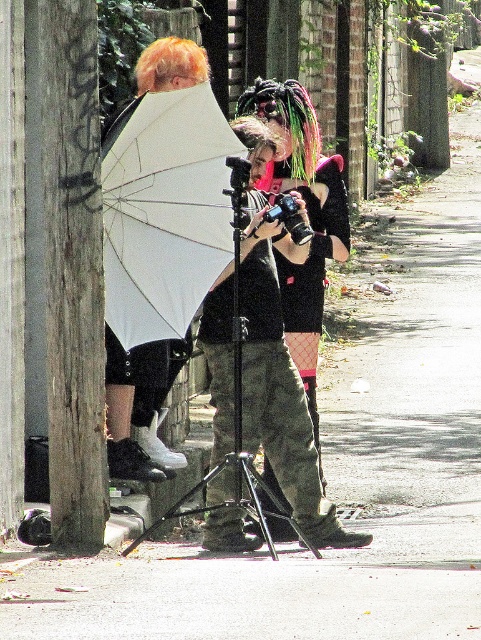
Can you confirm if white matte umbrella at upper center is shorter than matte black tripod at center?

Indeed, white matte umbrella at upper center has a lesser height compared to matte black tripod at center.

Who is higher up, white matte umbrella at upper center or matte black tripod at center?

Answer: white matte umbrella at upper center

Identify the location of white matte umbrella at upper center. This screenshot has width=481, height=640. (164, 211).

I want to click on white matte umbrella at upper center, so click(164, 211).

Does weathered wood pole at left have a greater height compared to fishnet stockings at center?

Indeed, weathered wood pole at left has a greater height compared to fishnet stockings at center.

Does weathered wood pole at left appear on the right side of fishnet stockings at center?

In fact, weathered wood pole at left is to the left of fishnet stockings at center.

Who is more distant from viewer, (77, 99) or (318, 193)?

The point (318, 193) is behind.

Identify the location of weathered wood pole at left. (65, 262).

Consider the image. How much distance is there between weathered wood pole at left and white matte umbrella at upper center?

They are 3.64 feet apart.

Is weathered wood pole at left below white matte umbrella at upper center?

Correct, weathered wood pole at left is located below white matte umbrella at upper center.

Between point (40, 330) and point (241, 150), which one is positioned in front?

Point (241, 150) is in front.

Where is `weathered wood pole at left`? The height and width of the screenshot is (640, 481). weathered wood pole at left is located at coordinates (65, 262).